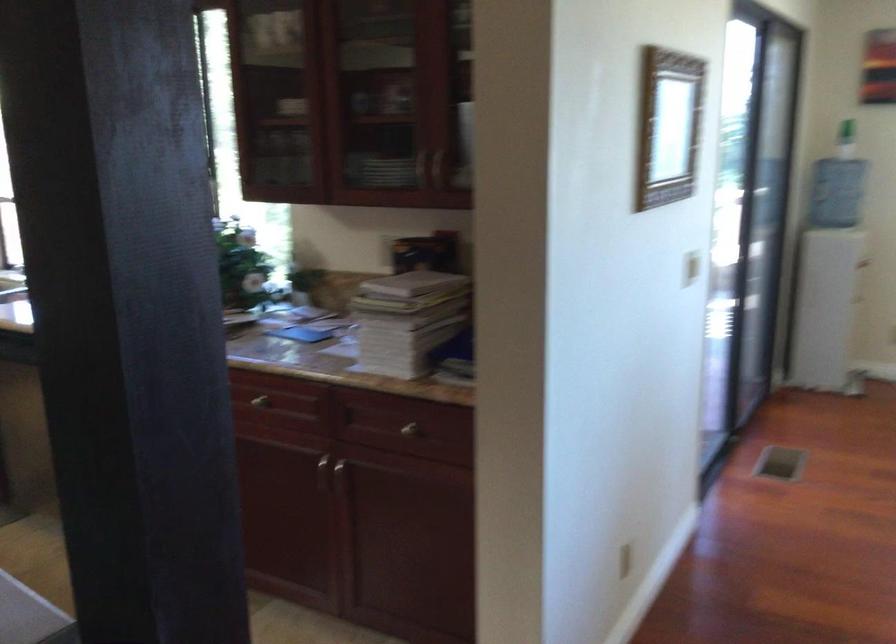
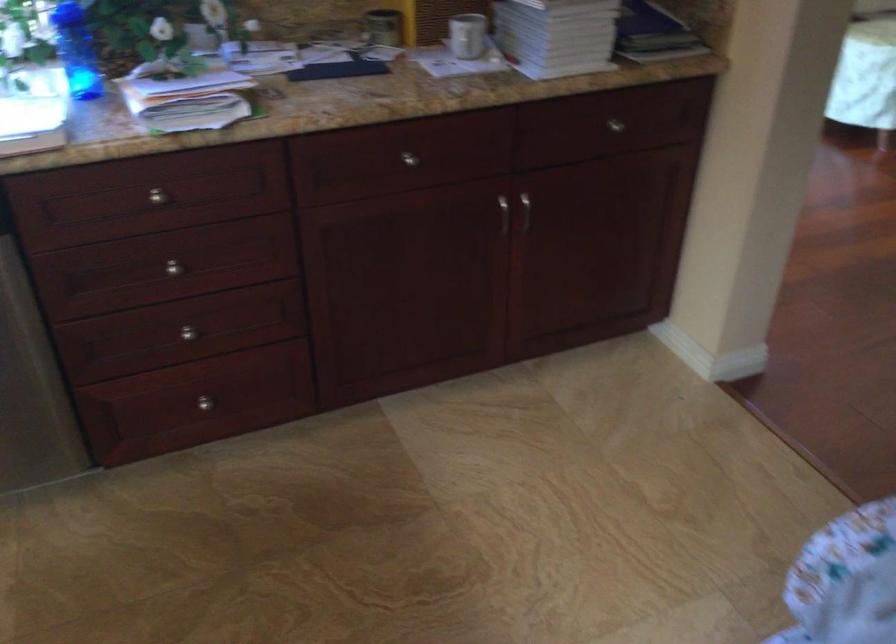
In the second image, find the point that corresponds to [357,330] in the first image.

(467, 35)